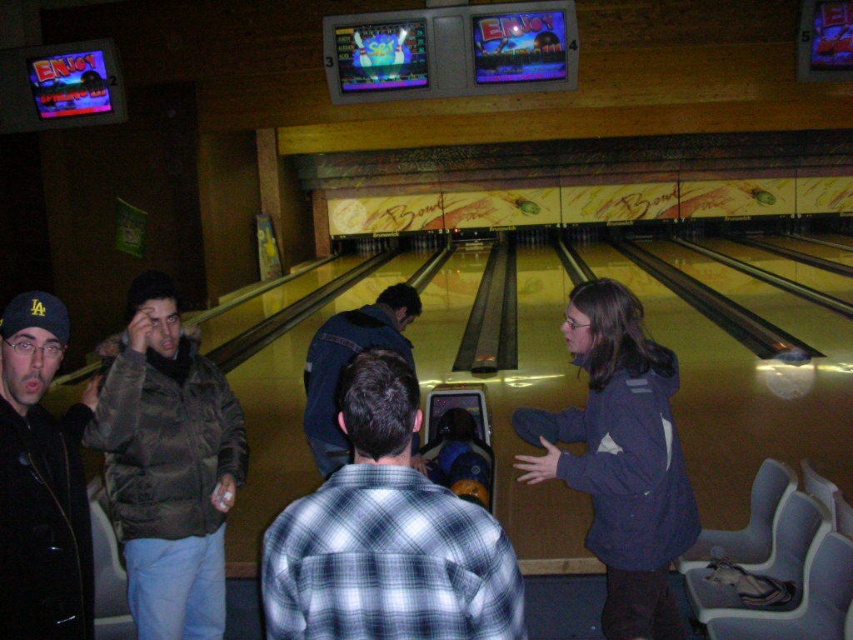
Question: Can you confirm if plaid cotton shirt at center is thinner than dark blue jeans at center?

Choices:
 (A) yes
 (B) no

Answer: (A)

Question: Is plaid cotton shirt at center closer to camera compared to black matte jacket at left?

Choices:
 (A) no
 (B) yes

Answer: (B)

Question: Can you confirm if brown fuzzy jacket at left is bigger than dark blue jeans at center?

Choices:
 (A) no
 (B) yes

Answer: (A)

Question: Among these objects, which one is farthest from the camera?

Choices:
 (A) black matte jacket at left
 (B) plaid cotton shirt at center

Answer: (A)

Question: Which of the following is the farthest from the observer?

Choices:
 (A) (198, 388)
 (B) (329, 545)
 (C) (384, 305)
 (D) (0, 580)

Answer: (C)

Question: Which point is farther from the camera taking this photo?

Choices:
 (A) (322, 586)
 (B) (181, 355)

Answer: (B)